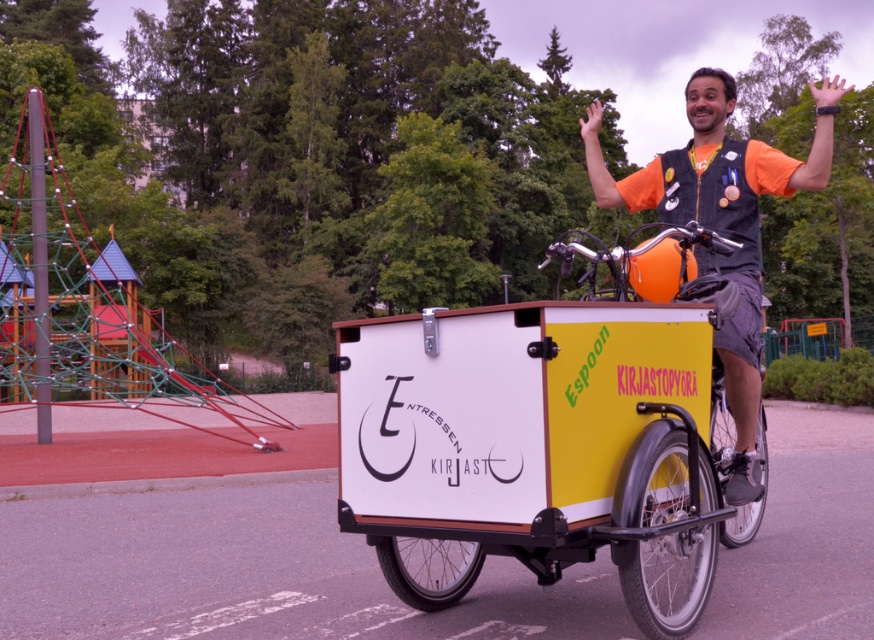
Can you confirm if white matte cargo bike at center is wider than orange fabric vest at upper center?

No.

Can you confirm if white matte cargo bike at center is smaller than orange fabric vest at upper center?

Indeed, white matte cargo bike at center has a smaller size compared to orange fabric vest at upper center.

Does point (757, 516) come in front of point (751, 348)?

No, (757, 516) is further to viewer.

What are the coordinates of `white matte cargo bike at center` in the screenshot? It's located at (542, 445).

Does point (387, 509) lie in front of point (636, 291)?

That is True.

Does white matte cargo bike at center come behind yellow matte cargo bike at center?

No, it is in front of yellow matte cargo bike at center.

Locate an element on the screen. Image resolution: width=874 pixels, height=640 pixels. white matte cargo bike at center is located at coordinates (542, 445).

Find the location of a particular element. The height and width of the screenshot is (640, 874). white matte cargo bike at center is located at coordinates (542, 445).

Can you confirm if orange fabric vest at upper center is shorter than yellow matte cargo bike at center?

Incorrect, orange fabric vest at upper center's height does not fall short of yellow matte cargo bike at center's.

Consider the image. Between orange fabric vest at upper center and yellow matte cargo bike at center, which one is positioned lower?

yellow matte cargo bike at center is below.

Does point (632, 177) come closer to viewer compared to point (760, 435)?

Yes, it is in front of point (760, 435).

Locate an element on the screen. Image resolution: width=874 pixels, height=640 pixels. orange fabric vest at upper center is located at coordinates (723, 221).